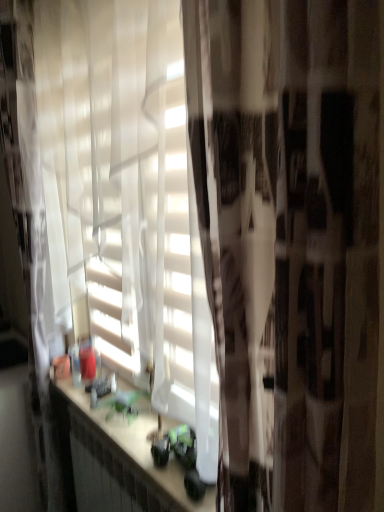
Image resolution: width=384 pixels, height=512 pixels. I want to click on matte white countertop at center, so click(x=122, y=462).

What do you see at coordinates (122, 462) in the screenshot? I see `matte white countertop at center` at bounding box center [122, 462].

The image size is (384, 512). I want to click on matte white countertop at center, so click(x=122, y=462).